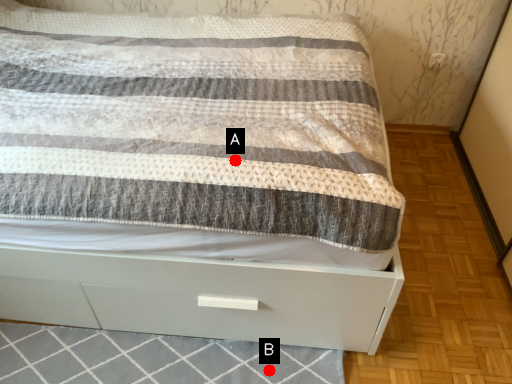
Question: Two points are circled on the image, labeled by A and B beside each circle. Which point is farther from the camera taking this photo?

Choices:
 (A) A is further
 (B) B is further

Answer: (B)